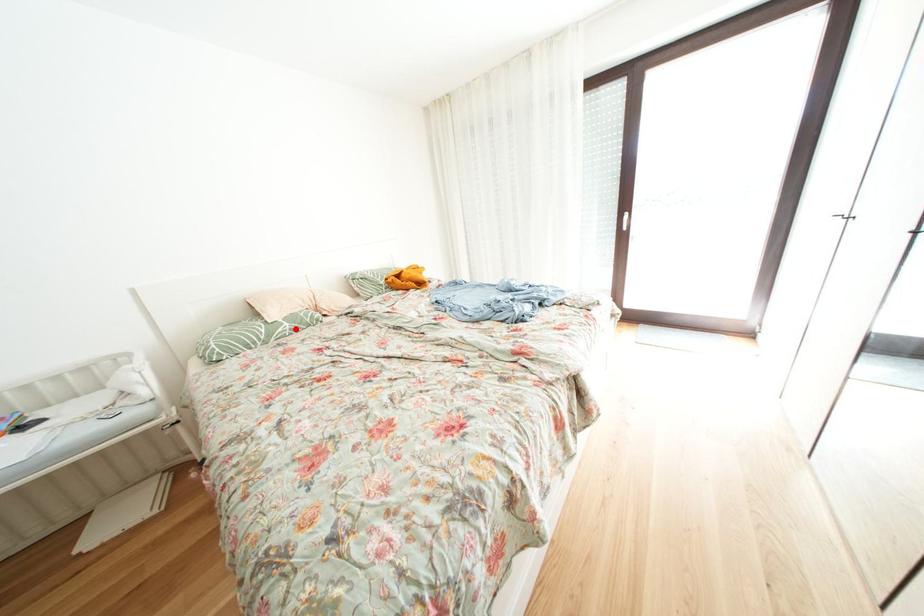
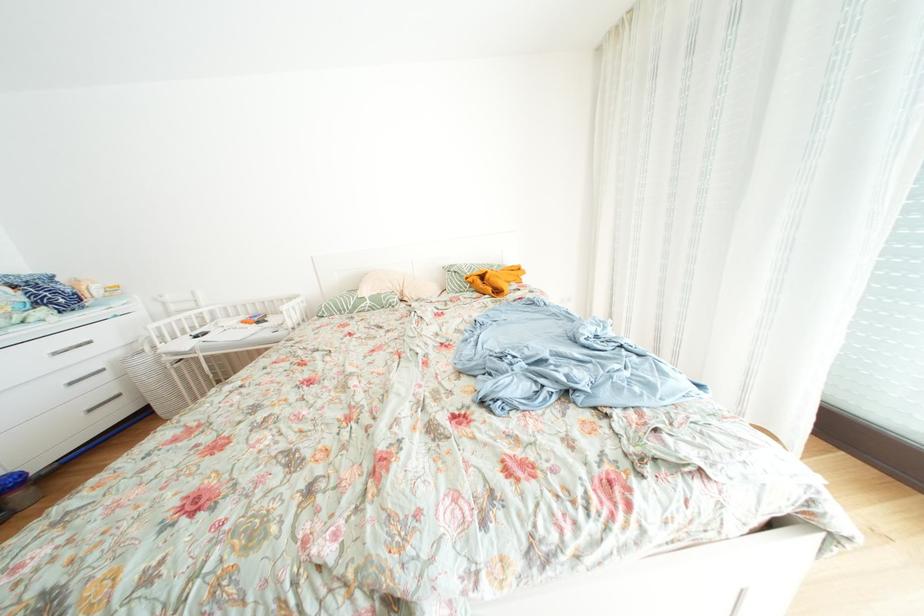
Question: I am providing you with two images of the same scene from different viewpoints. A red point is marked on the first image. Is the red point's position out of view in image 2?

Choices:
 (A) Yes
 (B) No

Answer: (B)